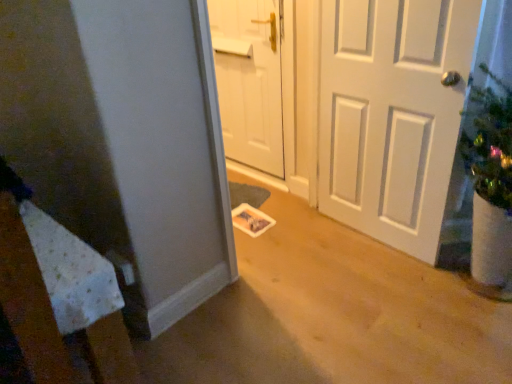
Where is `vacant region to the left of white matte door at right, the 2th door from the left`? This screenshot has height=384, width=512. vacant region to the left of white matte door at right, the 2th door from the left is located at coordinates (309, 247).